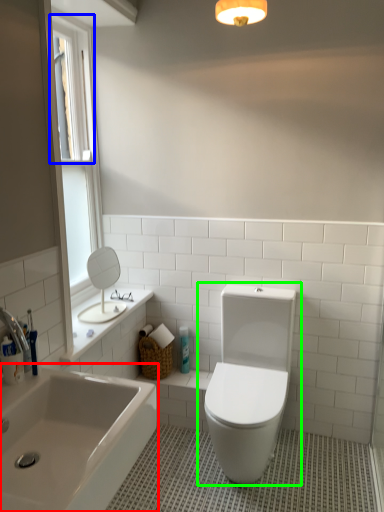
Question: Estimate the real-world distances between objects in this image. Which object is closer to bathtub (highlighted by a red box), window screen (highlighted by a blue box) or toilet (highlighted by a green box)?

Choices:
 (A) window screen
 (B) toilet

Answer: (B)